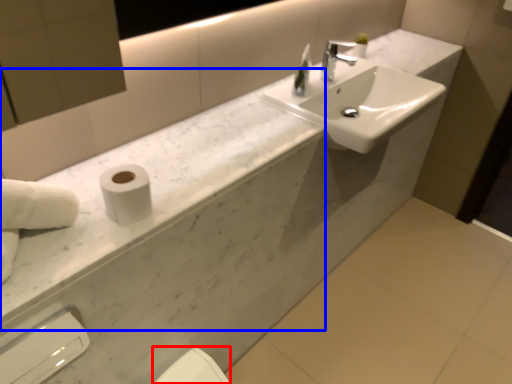
Question: Which object is closer to the camera taking this photo, bidet (highlighted by a red box) or counter top (highlighted by a blue box)?

Choices:
 (A) bidet
 (B) counter top

Answer: (B)